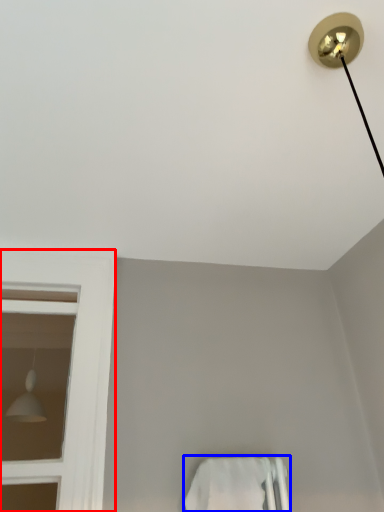
Question: Which object is closer to the camera taking this photo, bay window (highlighted by a red box) or towel bar (highlighted by a blue box)?

Choices:
 (A) bay window
 (B) towel bar

Answer: (B)